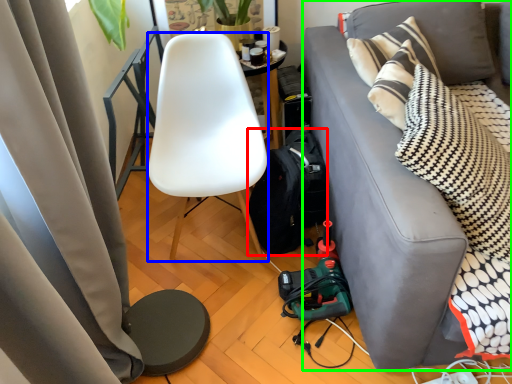
Question: Based on their relative distances, which object is farther from backpack (highlighted by a red box)? Choose from chair (highlighted by a blue box) and studio couch (highlighted by a green box).

Choices:
 (A) chair
 (B) studio couch

Answer: (B)